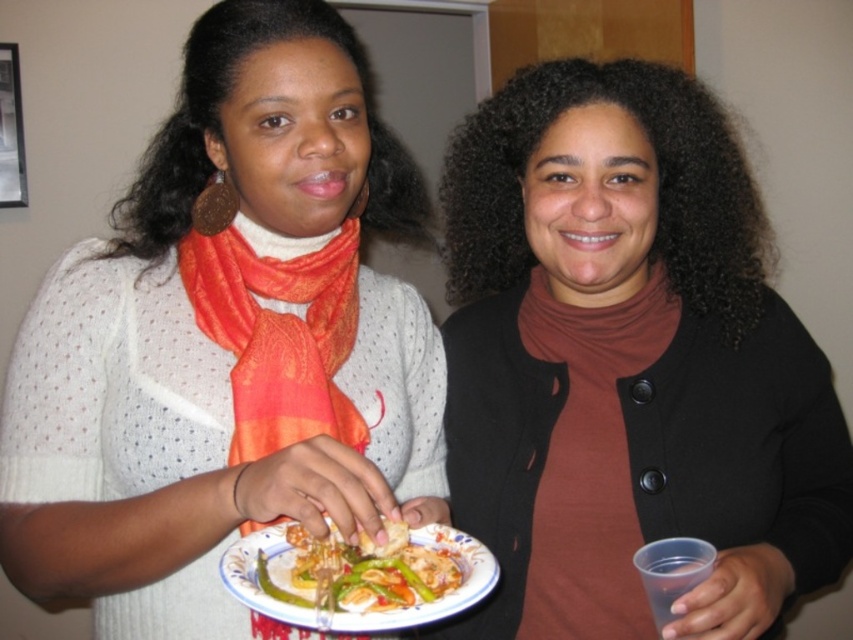
Question: In this image, where is matte orange scarf at center located relative to shiny plastic fork at lower center?

Choices:
 (A) right
 (B) left

Answer: (B)

Question: Can you confirm if brown matte sweater at center is positioned to the left of shiny plastic fork at lower center?

Choices:
 (A) no
 (B) yes

Answer: (A)

Question: Which point is closer to the camera taking this photo?

Choices:
 (A) (x=345, y=353)
 (B) (x=158, y=435)

Answer: (B)

Question: From the image, what is the correct spatial relationship of orange silk scarf at left in relation to shiny plastic fork at lower center?

Choices:
 (A) above
 (B) below

Answer: (A)

Question: Which object appears farthest from the camera in this image?

Choices:
 (A) brown matte sweater at center
 (B) shiny plastic fork at lower center
 (C) matte orange scarf at center
 (D) orange silk scarf at left

Answer: (D)

Question: Which point is farther from the camera taking this photo?

Choices:
 (A) (258, 330)
 (B) (320, 230)
 (C) (846, 493)

Answer: (C)